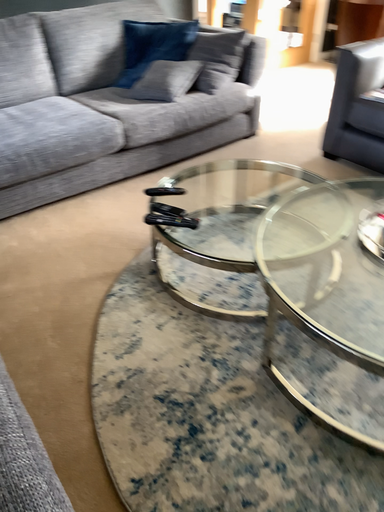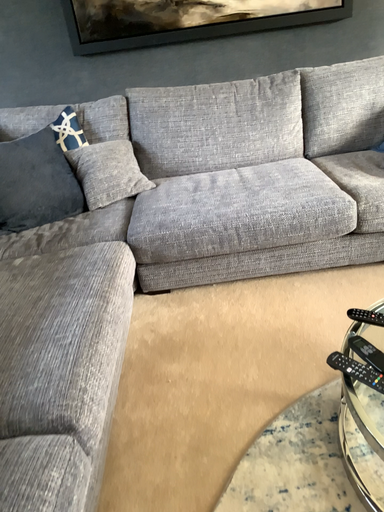
Question: How did the camera likely rotate when shooting the video?

Choices:
 (A) rotated upward
 (B) rotated downward

Answer: (A)